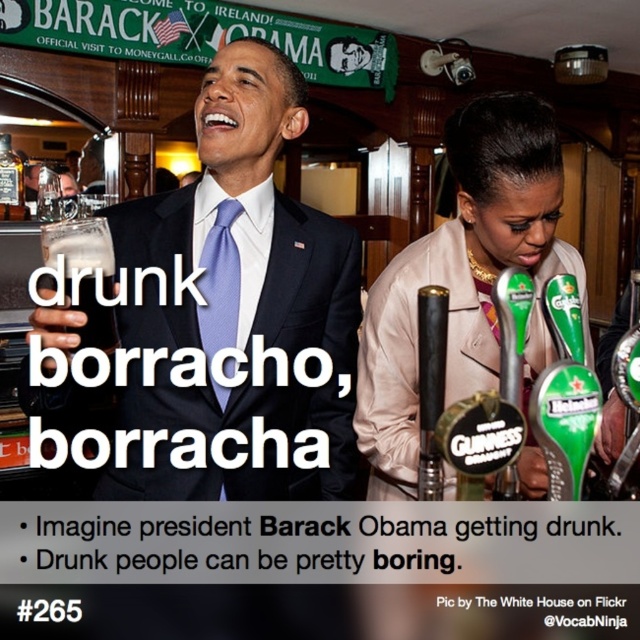
Describe the element at coordinates (221, 316) in the screenshot. The width and height of the screenshot is (640, 640). I see `matte black suit at center` at that location.

Consider the image. Does matte black suit at center appear over green plastic beer tap at right?

Yes.

Which is behind, point (292, 390) or point (602, 422)?

The point (292, 390) is behind.

Locate an element on the screen. matte black suit at center is located at coordinates (221, 316).

Does translucent glass beer at upper left have a larger size compared to green plastic beer tap at right?

Incorrect, translucent glass beer at upper left is not larger than green plastic beer tap at right.

Which of these two, translucent glass beer at upper left or green plastic beer tap at right, stands taller?

green plastic beer tap at right is taller.

Does point (109, 268) come closer to viewer compared to point (612, 429)?

That is True.

Locate an element on the screen. The image size is (640, 640). translucent glass beer at upper left is located at coordinates (84, 275).

Can you confirm if light beige fabric jacket at center is wider than matte blue tie at center?

Yes.

Looking at this image, measure the distance between point (378, 488) and camera.

Point (378, 488) is 4.56 feet away from camera.

Locate an element on the screen. This screenshot has height=640, width=640. light beige fabric jacket at center is located at coordinates (465, 278).